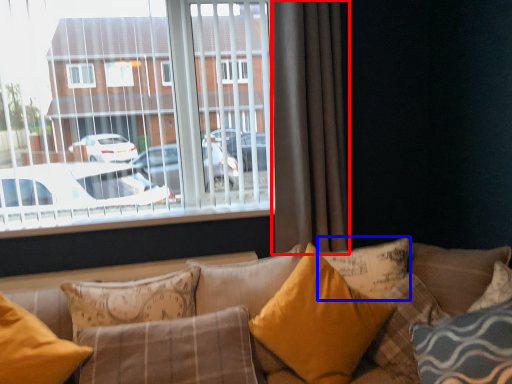
Question: Which of the following is the farthest to the observer, curtain (highlighted by a red box) or pillow (highlighted by a blue box)?

Choices:
 (A) curtain
 (B) pillow

Answer: (A)